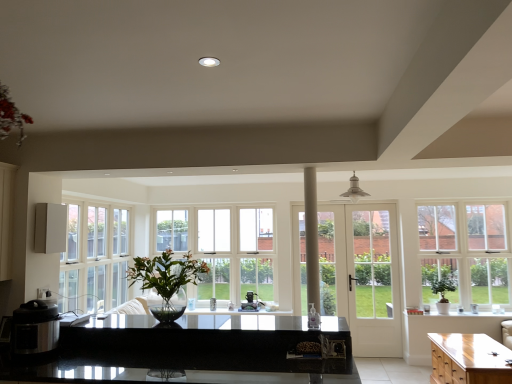
Question: Can you confirm if translucent glass vase at center, which appears as the 1th houseplant when viewed from the left, is positioned to the right of white wood window at center, placed as the first window when sorted from back to front?

Choices:
 (A) yes
 (B) no

Answer: (B)

Question: Is translucent glass vase at center, which appears as the 2th houseplant when viewed from the right, shorter than white wood window at center, which is the 1th window in left-to-right order?

Choices:
 (A) yes
 (B) no

Answer: (A)

Question: Considering the relative sizes of translucent glass vase at center, which appears as the 1th houseplant when viewed from the left, and white wood window at center, which is the 1th window in left-to-right order, in the image provided, is translucent glass vase at center, which appears as the 1th houseplant when viewed from the left, thinner than white wood window at center, which is the 1th window in left-to-right order,?

Choices:
 (A) yes
 (B) no

Answer: (B)

Question: Considering the relative sizes of translucent glass vase at center, the 1th houseplant in the front-to-back sequence, and white wood window at center, placed as the first window when sorted from back to front, in the image provided, is translucent glass vase at center, the 1th houseplant in the front-to-back sequence, smaller than white wood window at center, placed as the first window when sorted from back to front,?

Choices:
 (A) no
 (B) yes

Answer: (B)

Question: Is translucent glass vase at center, the 2th houseplant from the back, next to white wood window at center, placed as the second window when sorted from front to back, and touching it?

Choices:
 (A) yes
 (B) no

Answer: (B)

Question: Can you confirm if translucent glass vase at center, which appears as the 1th houseplant when viewed from the left, is taller than white wood window at center, placed as the 2th window when sorted from right to left?

Choices:
 (A) no
 (B) yes

Answer: (A)

Question: Is white glass door at center not close to black matte electric pressure cooker at left, the second appliance from the top?

Choices:
 (A) no
 (B) yes

Answer: (B)

Question: Is white glass door at center oriented towards black matte electric pressure cooker at left, the second appliance from the top?

Choices:
 (A) no
 (B) yes

Answer: (A)

Question: From the image's perspective, would you say white glass door at center is shown under black matte electric pressure cooker at left, the second appliance positioned from the right?

Choices:
 (A) yes
 (B) no

Answer: (A)

Question: Would you say black matte electric pressure cooker at left, the second appliance from the top, is part of white glass door at center's contents?

Choices:
 (A) yes
 (B) no

Answer: (B)

Question: Considering the relative sizes of white glass door at center and black matte electric pressure cooker at left, positioned as the 1th appliance in front-to-back order, in the image provided, is white glass door at center wider than black matte electric pressure cooker at left, positioned as the 1th appliance in front-to-back order,?

Choices:
 (A) no
 (B) yes

Answer: (A)

Question: Is white glass door at center positioned behind black matte electric pressure cooker at left, which is counted as the 2th appliance, starting from the left?

Choices:
 (A) yes
 (B) no

Answer: (A)

Question: From the image's perspective, is white glass window at right, which is the 1th window in front-to-back order, over satin black coffee maker at center, which is the 3th appliance from top to bottom?

Choices:
 (A) yes
 (B) no

Answer: (A)